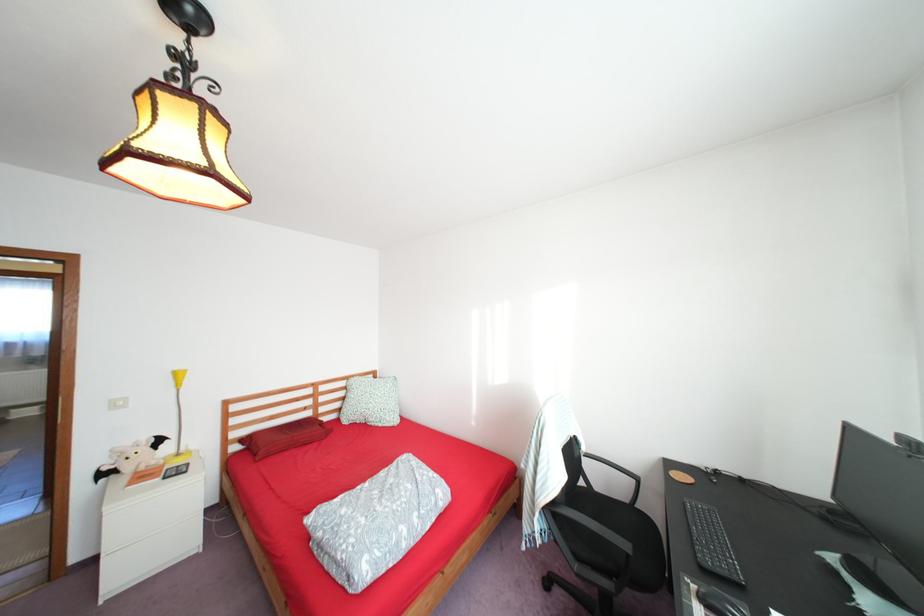
In order to click on chair sitting surface in this screenshot , I will do `click(619, 540)`.